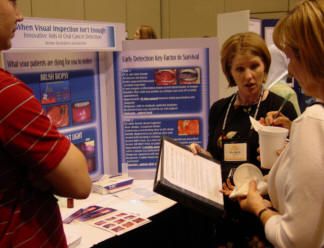
The width and height of the screenshot is (324, 248). In order to click on box in this screenshot , I will do `click(120, 189)`.